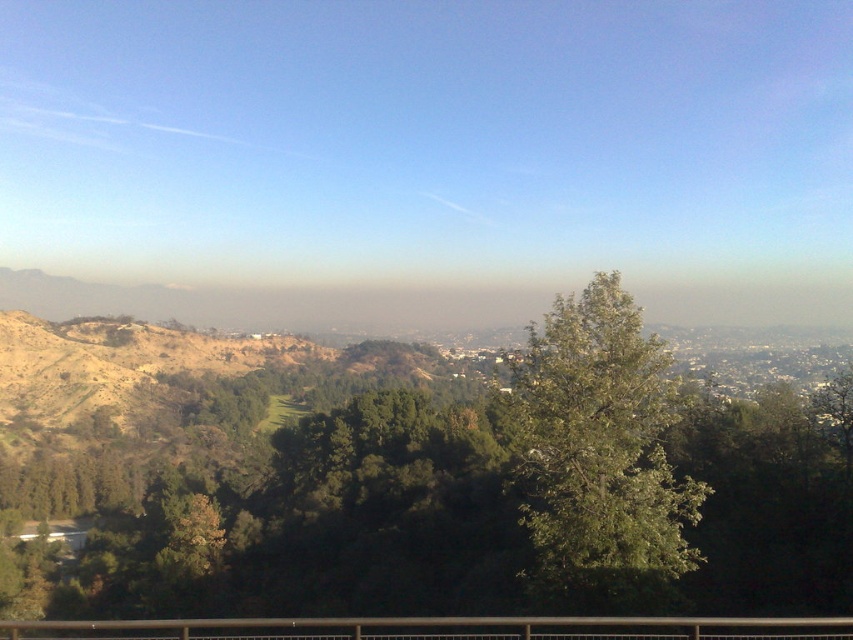
Question: Which object is closer to the camera taking this photo?

Choices:
 (A) green leafy tree at center
 (B) black metal rail at lower center

Answer: (B)

Question: From the image, what is the correct spatial relationship of green leafy tree at center in relation to black metal rail at lower center?

Choices:
 (A) above
 (B) below

Answer: (A)

Question: Among these objects, which one is farthest from the camera?

Choices:
 (A) black metal rail at lower center
 (B) green leafy tree at center

Answer: (B)

Question: Where is green leafy tree at center located in relation to black metal rail at lower center in the image?

Choices:
 (A) above
 (B) below

Answer: (A)

Question: Which point is farther to the camera?

Choices:
 (A) green leafy tree at center
 (B) black metal rail at lower center

Answer: (A)

Question: Is green leafy tree at center thinner than black metal rail at lower center?

Choices:
 (A) yes
 (B) no

Answer: (A)